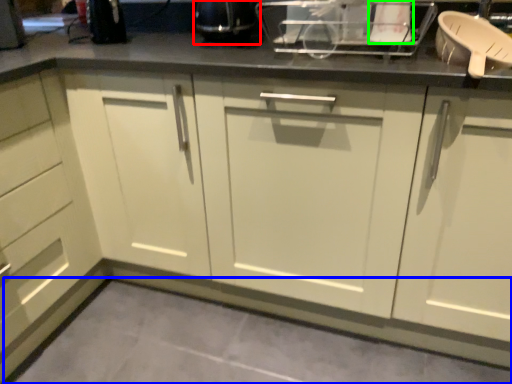
Question: Based on their relative distances, which object is farther from appliance (highlighted by a red box)? Choose from concrete (highlighted by a blue box) and appliance (highlighted by a green box).

Choices:
 (A) concrete
 (B) appliance

Answer: (A)